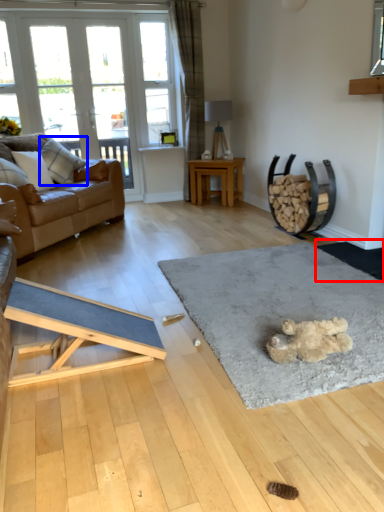
Question: Which point is further to the camera, doormat (highlighted by a red box) or pillow (highlighted by a blue box)?

Choices:
 (A) doormat
 (B) pillow

Answer: (B)